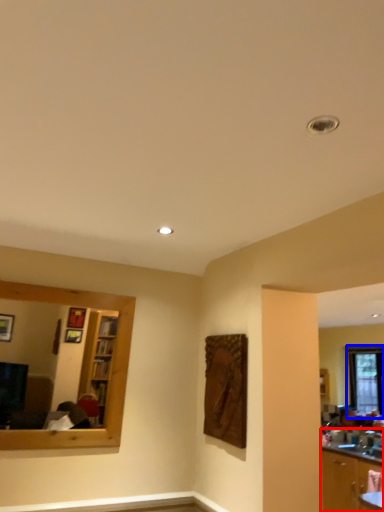
Question: Which point is closer to the camera, cabinetry (highlighted by a red box) or window (highlighted by a blue box)?

Choices:
 (A) cabinetry
 (B) window

Answer: (A)